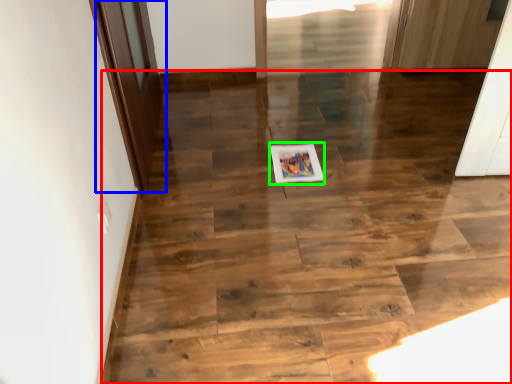
Question: Considering the real-world distances, which object is farthest from stairwell (highlighted by a red box)? door (highlighted by a blue box) or postcard (highlighted by a green box)?

Choices:
 (A) door
 (B) postcard

Answer: (A)